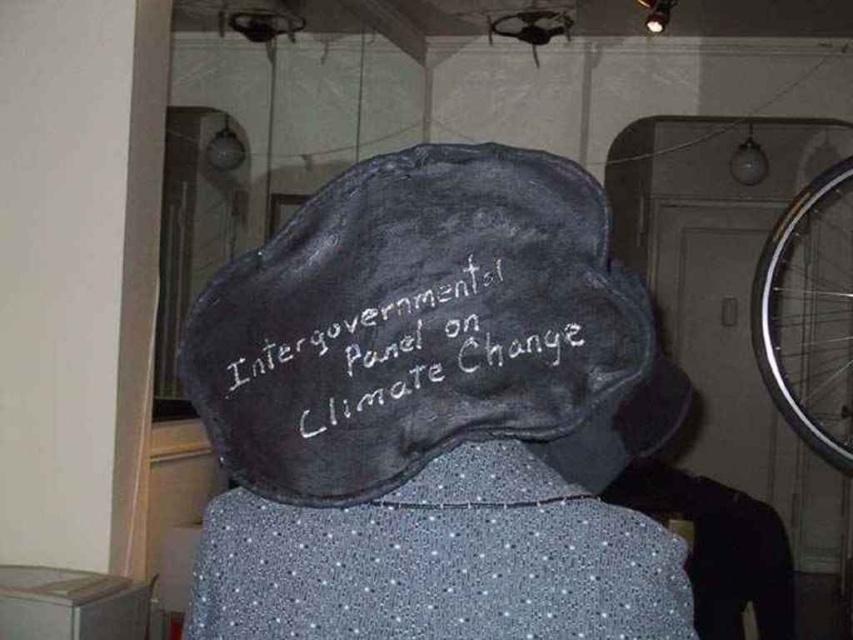
You are an artist planning to paint a portrait of the person wearing the dark gray felt baseball hat at center. The black chalkboard at center is part of the background. To ensure proper perspective, which object should be placed higher in your painting?

The dark gray felt baseball hat at center should be placed higher in the painting since it is positioned over the black chalkboard at center.

You are standing in the room and see two points marked in the image. Which point is closer to you, point (531,156) or point (503,317)?

Point (503,317) is closer to you because point (531,156) is behind it.

In the scene shown: You are standing in the scene and see two points marked in the image. Which point is closer to you, point (479, 300) or point (805, 289)?

Point (479, 300) is in front of point (805, 289), so it is closer to you.